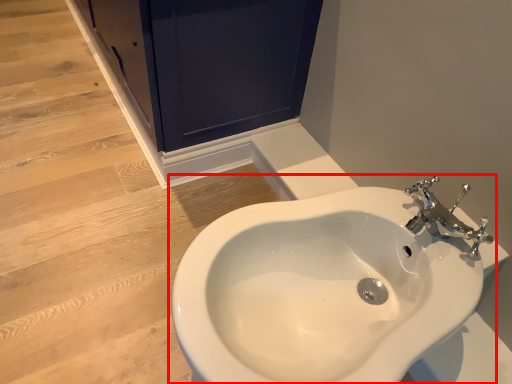
Question: Considering the relative positions of sink (annotated by the red box) and screen door in the image provided, where is sink (annotated by the red box) located with respect to the staircase?

Choices:
 (A) left
 (B) right

Answer: (B)